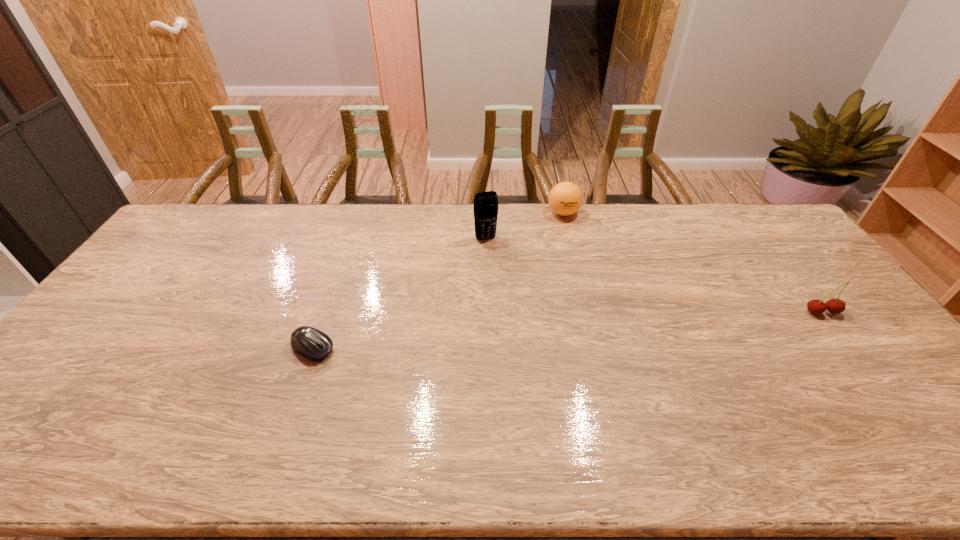
Locate an element on the screen. blank region between the third object from left to right and the shortest object is located at coordinates (438, 280).

You are a GUI agent. You are given a task and a screenshot of the screen. Output one action in this format:
    pyautogui.click(x=<x>, y=<y>)
    Task: Click on the free area in between the second object from right to left and the tallest object
    
    Given the screenshot: What is the action you would take?
    pyautogui.click(x=524, y=226)

You are a GUI agent. You are given a task and a screenshot of the screen. Output one action in this format:
    pyautogui.click(x=<x>, y=<y>)
    Task: Click on the free spot between the second object from left to right and the ping-pong ball
    Image resolution: width=960 pixels, height=540 pixels.
    Given the screenshot: What is the action you would take?
    pyautogui.click(x=524, y=226)

The height and width of the screenshot is (540, 960). I want to click on vacant point located between the nearest object and the cherry, so click(567, 330).

Select which object appears as the closest to the ping-pong ball. Please provide its 2D coordinates. Your answer should be formatted as a tuple, i.e. [(x, y)], where the tuple contains the x and y coordinates of a point satisfying the conditions above.

[(485, 203)]

At what (x,y) coordinates should I click in order to perform the action: click on object that is the third closest to the second object from left to right. Please return your answer as a coordinate pair (x, y). Looking at the image, I should click on (835, 306).

Find the location of `blank area in the image that satisfies the following two spatial constraints: 1. on the back side of the mouse; 2. on the left side of the ping-pong ball`. blank area in the image that satisfies the following two spatial constraints: 1. on the back side of the mouse; 2. on the left side of the ping-pong ball is located at coordinates (360, 213).